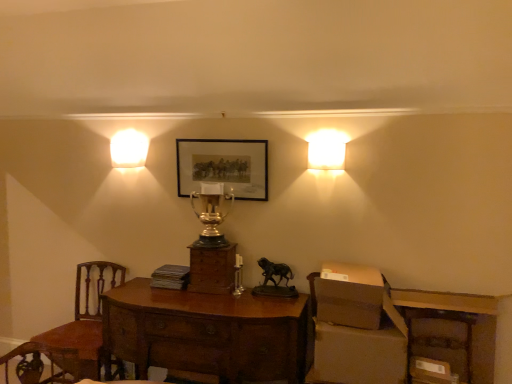
Question: Does brown cardboard box at right, which is counted as the third cardboard box, starting from the bottom, appear on the left side of matte gold trophy at upper center, the 1th lamp positioned from the left?

Choices:
 (A) yes
 (B) no

Answer: (B)

Question: Is brown cardboard box at right, the 1th cardboard box when ordered from top to bottom, positioned in front of matte gold trophy at upper center, placed as the 1th lamp when sorted from back to front?

Choices:
 (A) no
 (B) yes

Answer: (B)

Question: Is matte gold trophy at upper center, the 1th lamp positioned from the left, inside brown cardboard box at right, which is counted as the third cardboard box, starting from the bottom?

Choices:
 (A) yes
 (B) no

Answer: (B)

Question: Is brown cardboard box at right, the 1th cardboard box when ordered from top to bottom, beside matte gold trophy at upper center, which ranks as the 2th lamp in right-to-left order?

Choices:
 (A) yes
 (B) no

Answer: (B)

Question: Does brown cardboard box at right, which is counted as the third cardboard box, starting from the bottom, have a greater width compared to matte gold trophy at upper center, placed as the 2th lamp when sorted from front to back?

Choices:
 (A) no
 (B) yes

Answer: (B)

Question: Looking at their shapes, would you say brown wooden desk at lower right is wider or thinner than mahogany wood desk at center?

Choices:
 (A) wide
 (B) thin

Answer: (B)

Question: From their relative heights in the image, would you say brown wooden desk at lower right is taller or shorter than mahogany wood desk at center?

Choices:
 (A) short
 (B) tall

Answer: (A)

Question: From the image's perspective, is brown wooden desk at lower right positioned above or below mahogany wood desk at center?

Choices:
 (A) below
 (B) above

Answer: (B)

Question: Considering the positions of brown wooden desk at lower right and mahogany wood desk at center in the image, is brown wooden desk at lower right bigger or smaller than mahogany wood desk at center?

Choices:
 (A) small
 (B) big

Answer: (A)

Question: Considering the positions of brown cardboard box at lower right, placed as the 2th cardboard box when sorted from bottom to top, and matte black picture frame at center in the image, is brown cardboard box at lower right, placed as the 2th cardboard box when sorted from bottom to top, wider or thinner than matte black picture frame at center?

Choices:
 (A) wide
 (B) thin

Answer: (A)

Question: Looking at the image, does brown cardboard box at lower right, placed as the 2th cardboard box when sorted from bottom to top, seem bigger or smaller compared to matte black picture frame at center?

Choices:
 (A) big
 (B) small

Answer: (A)

Question: Visually, is brown cardboard box at lower right, placed as the 2th cardboard box when sorted from bottom to top, positioned to the left or to the right of matte black picture frame at center?

Choices:
 (A) right
 (B) left

Answer: (A)

Question: Relative to matte black picture frame at center, is brown cardboard box at lower right, which is the second cardboard box in top-to-bottom order, in front or behind?

Choices:
 (A) front
 (B) behind

Answer: (A)

Question: Looking at the image, does gold polished trophy at center seem bigger or smaller compared to brown cardboard box at lower right, acting as the first cardboard box starting from the bottom?

Choices:
 (A) small
 (B) big

Answer: (B)

Question: Considering the positions of gold polished trophy at center and brown cardboard box at lower right, the 3th cardboard box positioned from the top, in the image, is gold polished trophy at center taller or shorter than brown cardboard box at lower right, the 3th cardboard box positioned from the top,?

Choices:
 (A) short
 (B) tall

Answer: (B)